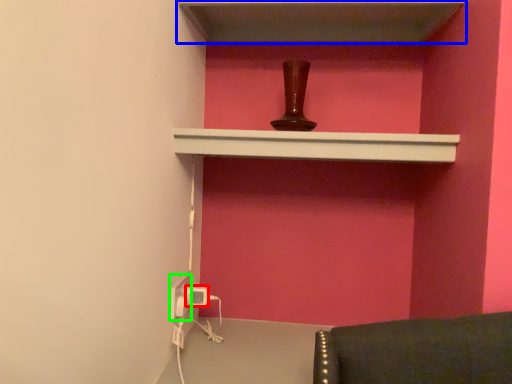
Question: Based on their relative distances, which object is farther from electric outlet (highlighted by a red box)? Choose from shelf (highlighted by a blue box) and electric outlet (highlighted by a green box).

Choices:
 (A) shelf
 (B) electric outlet

Answer: (A)